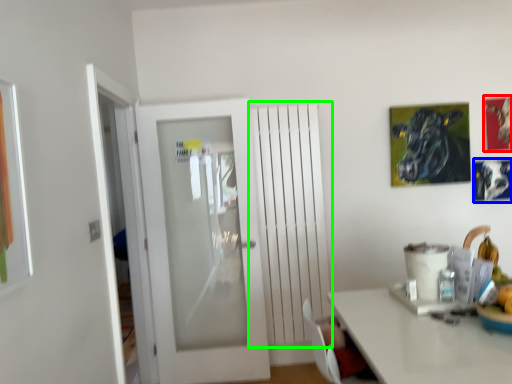
Question: Which is nearer to the picture frame (highlighted by a red box)? picture frame (highlighted by a blue box) or radiator (highlighted by a green box).

Choices:
 (A) picture frame
 (B) radiator

Answer: (A)